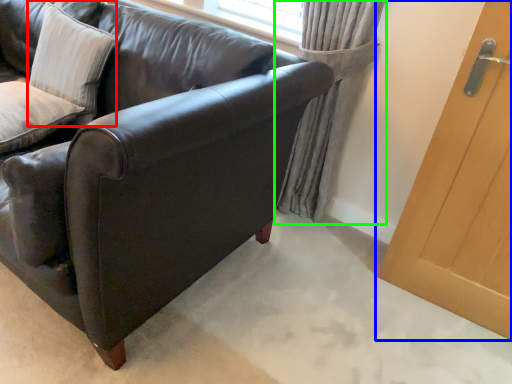
Question: Based on their relative distances, which object is farther from pillow (highlighted by a red box)? Choose from door (highlighted by a blue box) and curtain (highlighted by a green box).

Choices:
 (A) door
 (B) curtain

Answer: (A)